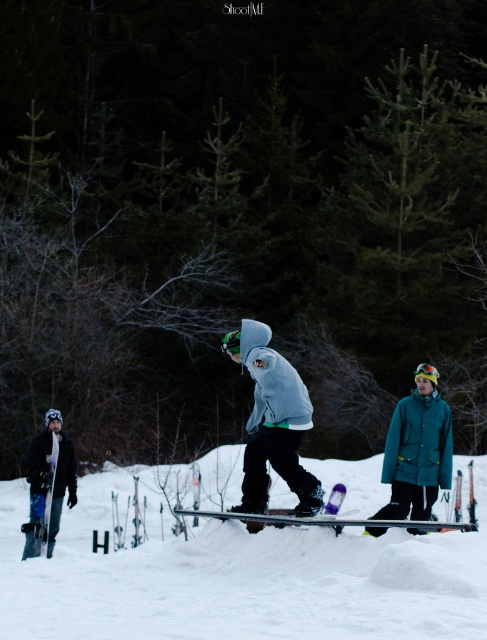
You are a photographer trying to capture both the matte gray hoodie at center and the matte purple snowboard at lower left in a single frame. Based on their sizes, which object should you focus on first to ensure both are in the frame?

The matte gray hoodie at center is bigger than the matte purple snowboard at lower left, so you should focus on the matte gray hoodie at center first to ensure both objects fit in the frame.

You are a photographer trying to capture a photo of the snowboarder and the snow. Based on the scene, where should you position yourself relative to the matte gray hoodie at center and the white fluffy snow at center to include both in the frame?

You should position yourself to the left of the matte gray hoodie at center because the white fluffy snow at center is on the right side of the matte gray hoodie at center, allowing both to be captured in the frame.